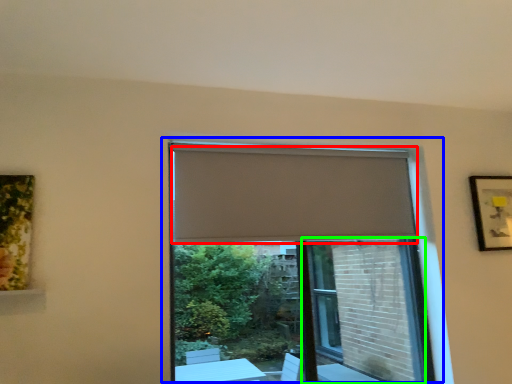
Question: Which is nearer to the curtain (highlighted by a red box)? window (highlighted by a blue box) or screen door (highlighted by a green box).

Choices:
 (A) window
 (B) screen door

Answer: (B)